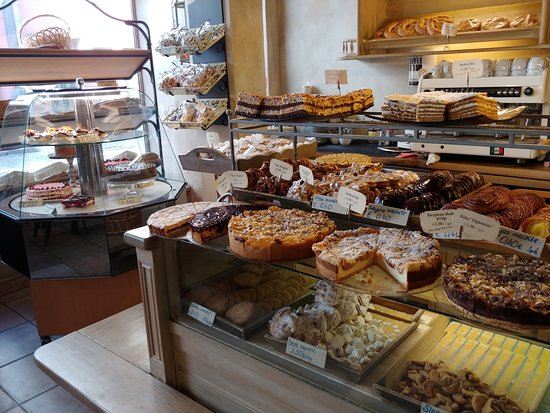
You are a GUI agent. You are given a task and a screenshot of the screen. Output one action in this format:
    pyautogui.click(x=<x>, y=<y>)
    Task: Click on the coffee machine
    The width and height of the screenshot is (550, 413).
    Given the screenshot: What is the action you would take?
    point(508,81)